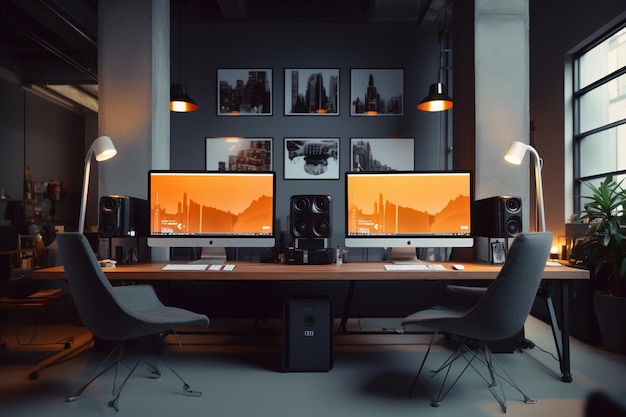
Locate an element on the screen. This screenshot has height=417, width=626. plant is located at coordinates (608, 228).